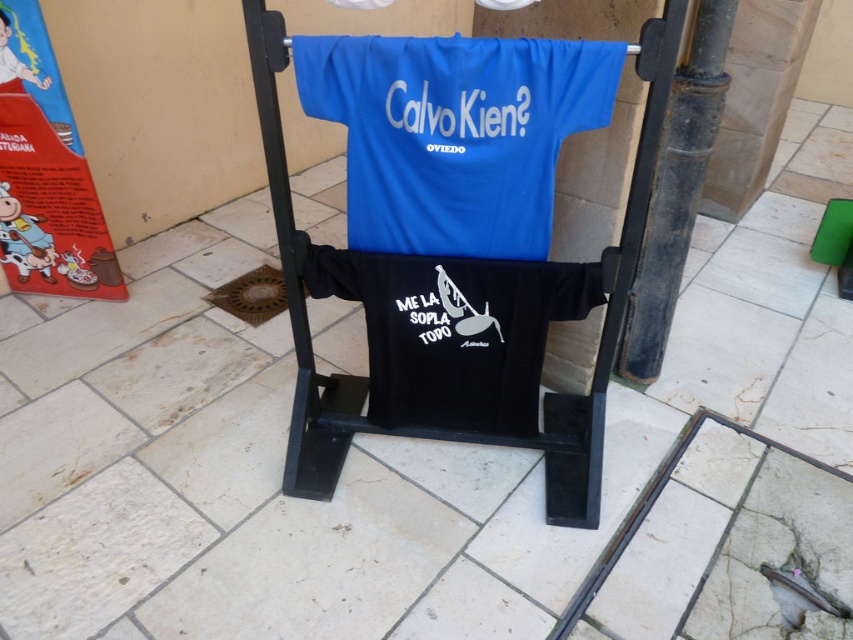
Between point (514, 106) and point (572, 420), which one is positioned behind?

The point (572, 420) is behind.

Locate an element on the screen. blue fabric t-shirt at center is located at coordinates (454, 132).

The width and height of the screenshot is (853, 640). Identify the location of blue fabric t-shirt at center. (454, 132).

Does black matte t-shirt at center lie in front of metallic black folding chair at center?

No, black matte t-shirt at center is further to the viewer.

Which of these two, black matte t-shirt at center or metallic black folding chair at center, stands shorter?

black matte t-shirt at center

Where is `black matte t-shirt at center`? The image size is (853, 640). black matte t-shirt at center is located at coordinates (454, 332).

You are a GUI agent. You are given a task and a screenshot of the screen. Output one action in this format:
    pyautogui.click(x=<x>, y=<y>)
    Task: Click on the black matte t-shirt at center
    
    Given the screenshot: What is the action you would take?
    pyautogui.click(x=454, y=332)

Who is more distant from viewer, (x=341, y=38) or (x=718, y=88)?

The point (x=718, y=88) is behind.

Is point (408, 230) positioned before point (642, 356)?

Yes, point (408, 230) is in front of point (642, 356).

Is point (357, 40) positioned behind point (685, 64)?

That is False.

You are a GUI agent. You are given a task and a screenshot of the screen. Output one action in this format:
    pyautogui.click(x=<x>, y=<y>)
    Task: Click on the blue fabric t-shirt at center
    The image size is (853, 640).
    Given the screenshot: What is the action you would take?
    pyautogui.click(x=454, y=132)